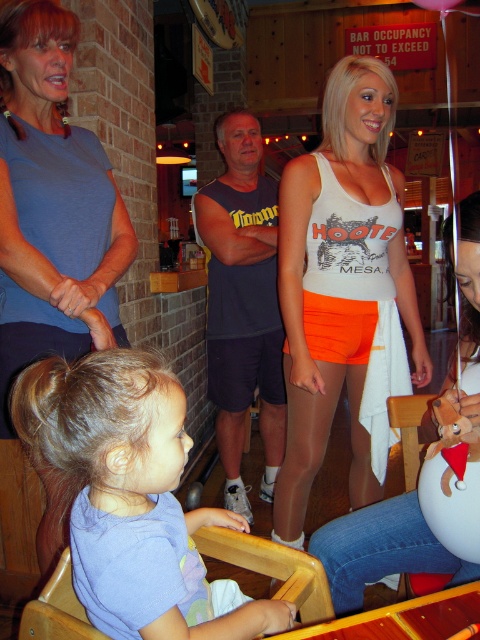
Can you confirm if purple cotton shirt at center is smaller than white cotton tank top at center?

Correct, purple cotton shirt at center occupies less space than white cotton tank top at center.

Between purple cotton shirt at center and white cotton tank top at center, which one appears on the left side from the viewer's perspective?

From the viewer's perspective, purple cotton shirt at center appears more on the left side.

The image size is (480, 640). What do you see at coordinates (131, 497) in the screenshot?
I see `purple cotton shirt at center` at bounding box center [131, 497].

In order to click on purple cotton shirt at center in this screenshot , I will do `click(131, 497)`.

Which is more to the right, white tank top at center or purple cotton shirt at center?

white tank top at center

This screenshot has width=480, height=640. Identify the location of white tank top at center. (339, 284).

What do you see at coordinates (339, 284) in the screenshot? The image size is (480, 640). I see `white tank top at center` at bounding box center [339, 284].

Where is `white tank top at center`? white tank top at center is located at coordinates (339, 284).

Is white tank top at center shorter than white cotton tank top at center?

In fact, white tank top at center may be taller than white cotton tank top at center.

The height and width of the screenshot is (640, 480). In order to click on white tank top at center in this screenshot , I will do `click(339, 284)`.

I want to click on white tank top at center, so click(339, 284).